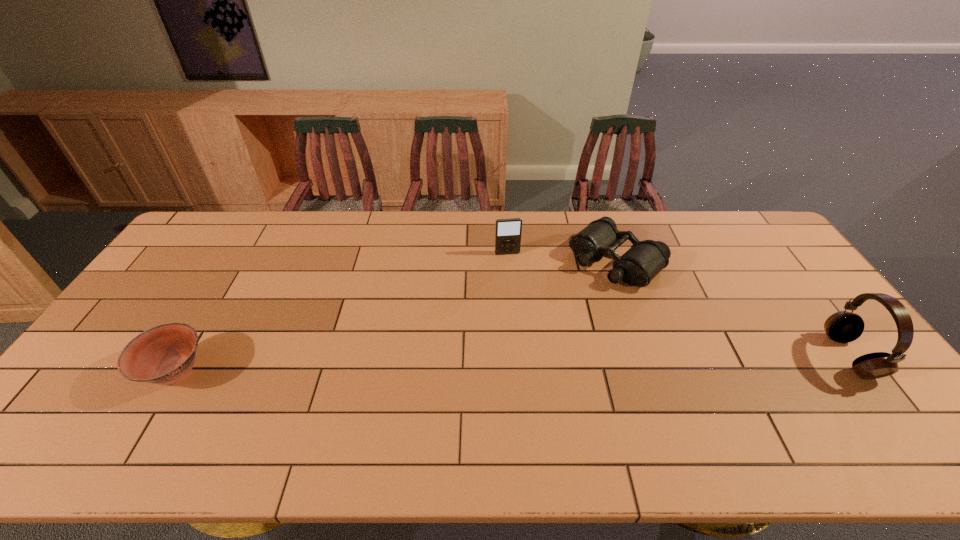
Where is `vacant area located 0.160m through the eyepieces of the binoculars`? This screenshot has width=960, height=540. vacant area located 0.160m through the eyepieces of the binoculars is located at coordinates (559, 310).

At what (x,y) coordinates should I click in order to perform the action: click on vacant space located through the eyepieces of the binoculars. Please return your answer as a coordinate pair (x, y). Image resolution: width=960 pixels, height=540 pixels. Looking at the image, I should click on (581, 292).

I want to click on free spot located through the eyepieces of the binoculars, so click(567, 303).

What are the coordinates of `iPod present at the far edge` in the screenshot? It's located at (508, 232).

At what (x,y) coordinates should I click in order to perform the action: click on binoculars that is at the far edge. Please return your answer as a coordinate pair (x, y). The image size is (960, 540). Looking at the image, I should click on (645, 259).

Image resolution: width=960 pixels, height=540 pixels. What are the coordinates of `bowl positioned at the near edge` in the screenshot? It's located at (165, 354).

At what (x,y) coordinates should I click in order to perform the action: click on headset that is at the near edge. Please return your answer as a coordinate pair (x, y). Looking at the image, I should click on (843, 327).

Identify the location of object present at the left edge. (165, 354).

Locate an element on the screen. Image resolution: width=960 pixels, height=540 pixels. object at the right edge is located at coordinates (843, 327).

Image resolution: width=960 pixels, height=540 pixels. In order to click on object that is positioned at the near left corner in this screenshot , I will do `click(165, 354)`.